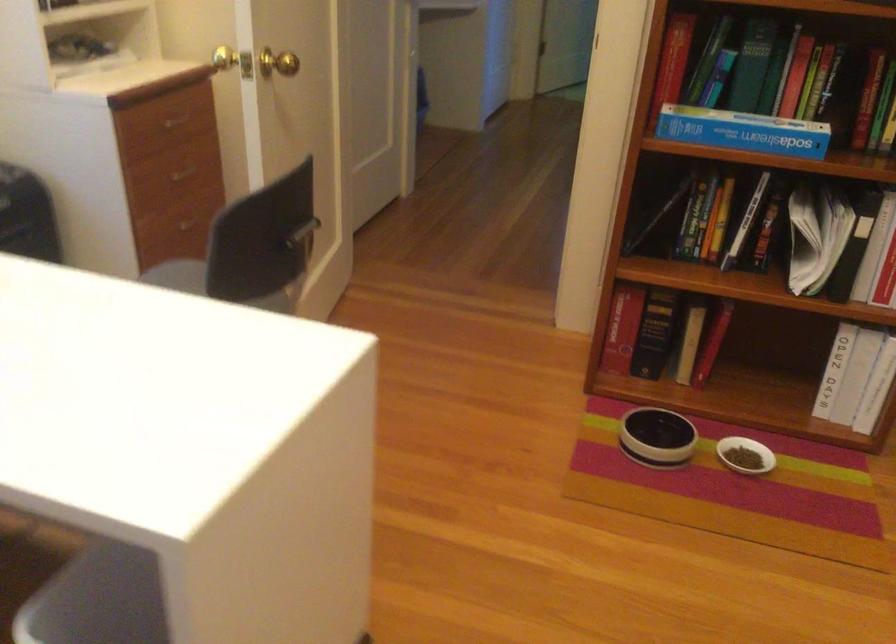
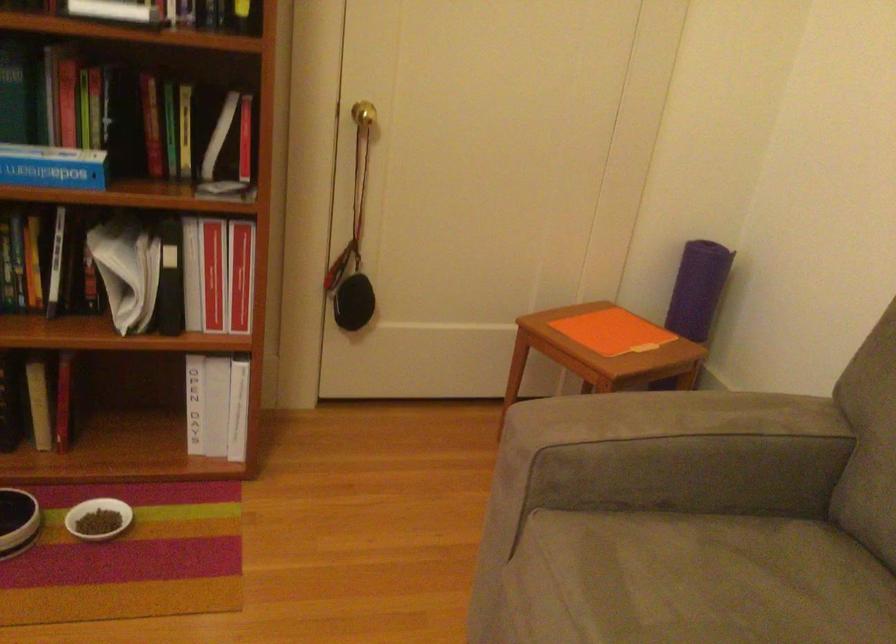
The point at (739, 451) is marked in the first image. Where is the corresponding point in the second image?

(98, 518)